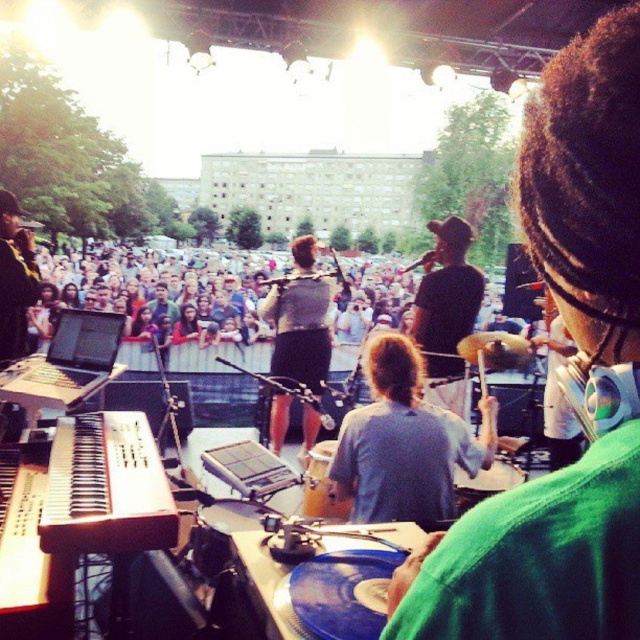
Is gray fabric shirt at center shorter than wooden piano at center?

No, gray fabric shirt at center is not shorter than wooden piano at center.

This screenshot has height=640, width=640. What do you see at coordinates (404, 444) in the screenshot?
I see `gray fabric shirt at center` at bounding box center [404, 444].

Where is `gray fabric shirt at center`? The height and width of the screenshot is (640, 640). gray fabric shirt at center is located at coordinates (404, 444).